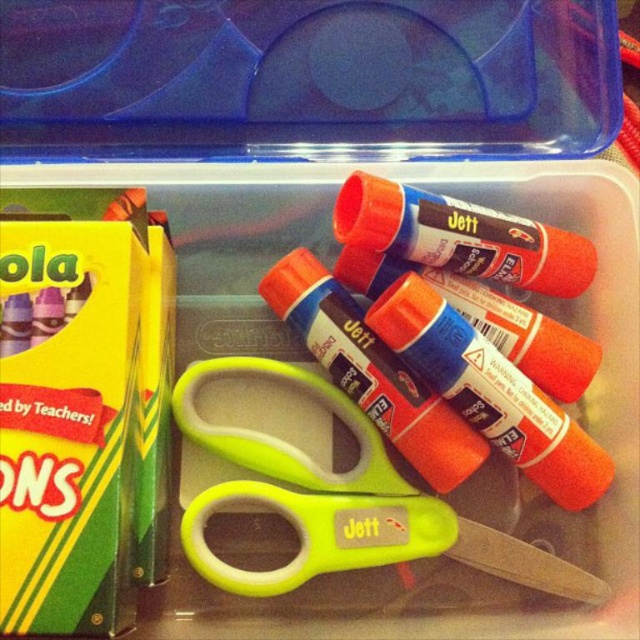
You need to locate the green plastic scissors at center and the matte plastic glue sticks at center inside the storage container. According to their positions, which item is closer to the left edge of the container?

The matte plastic glue sticks at center are closer to the left edge of the container because the green plastic scissors at center are positioned to the right of them.

You are a student trying to reach the matte orange glue stick at center in the plastic storage container. If your hand can extend 80 centimeters, will you be able to reach it?

The matte orange glue stick at center is 90.78 centimeters away from the viewer. Since your hand can only extend 80 centimeters, you will not be able to reach it.

You need to determine which item is taller between the green plastic scissors at center and the matte plastic glue sticks at center in the storage container. Which one is taller?

The matte plastic glue sticks at center are taller than the green plastic scissors at center.